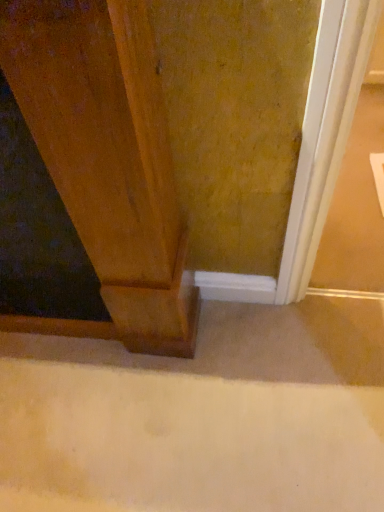
Describe the element at coordinates (206, 413) in the screenshot. I see `beige carpet at lower center` at that location.

The height and width of the screenshot is (512, 384). I want to click on beige carpet at lower center, so click(x=206, y=413).

The height and width of the screenshot is (512, 384). Describe the element at coordinates (108, 155) in the screenshot. I see `wooden door at left` at that location.

Locate an element on the screen. This screenshot has height=512, width=384. wooden door at left is located at coordinates (108, 155).

Locate an element on the screen. The width and height of the screenshot is (384, 512). beige carpet at lower center is located at coordinates (206, 413).

Does wooden door at left appear on the left side of beige carpet at lower center?

Yes.

Which object is further away from the camera taking this photo, wooden door at left or beige carpet at lower center?

beige carpet at lower center is more distant.

Does point (13, 89) come closer to viewer compared to point (123, 384)?

Yes, it is.

From the image's perspective, which is below, wooden door at left or beige carpet at lower center?

beige carpet at lower center, from the image's perspective.

From a real-world perspective, is wooden door at left under beige carpet at lower center?

Actually, wooden door at left is physically above beige carpet at lower center in the real world.

Which of these two, wooden door at left or beige carpet at lower center, is thinner?

With smaller width is wooden door at left.

Considering the sizes of wooden door at left and beige carpet at lower center in the image, is wooden door at left taller or shorter than beige carpet at lower center?

Considering their sizes, wooden door at left has more height than beige carpet at lower center.

Based on their sizes in the image, would you say wooden door at left is bigger or smaller than beige carpet at lower center?

In the image, wooden door at left appears to be larger than beige carpet at lower center.

Is wooden door at left positioned beyond the bounds of beige carpet at lower center?

wooden door at left lies outside beige carpet at lower center's area.

Is wooden door at left not near beige carpet at lower center?

No, wooden door at left is not far away from beige carpet at lower center.

Could you tell me if wooden door at left is turned towards beige carpet at lower center?

No, wooden door at left is not facing towards beige carpet at lower center.

How many degrees apart are the facing directions of wooden door at left and beige carpet at lower center?

89.9 degrees separate the facing orientations of wooden door at left and beige carpet at lower center.

Image resolution: width=384 pixels, height=512 pixels. Identify the location of door above the beige carpet at lower center (from the image's perspective). (108, 155).

Which is more to the left, beige carpet at lower center or wooden door at left?

wooden door at left.

Which is in front, beige carpet at lower center or wooden door at left?

wooden door at left is more forward.

Which is in front, point (188, 445) or point (63, 122)?

The point (63, 122) is in front.

From the image's perspective, is beige carpet at lower center located above wooden door at left?

No.

From a real-world perspective, is beige carpet at lower center positioned above or below wooden door at left?

In terms of real-world spatial position, beige carpet at lower center is below wooden door at left.

Can you confirm if beige carpet at lower center is thinner than wooden door at left?

No.

Is beige carpet at lower center taller than wooden door at left?

No, beige carpet at lower center is not taller than wooden door at left.

Looking at this image, in terms of size, does beige carpet at lower center appear bigger or smaller than wooden door at left?

In the image, beige carpet at lower center appears to be smaller than wooden door at left.

Is beige carpet at lower center inside or outside of wooden door at left?

The correct answer is: outside.

Based on the photo, are beige carpet at lower center and wooden door at left beside each other?

beige carpet at lower center and wooden door at left are clearly separated.

Is wooden door at left at the back of beige carpet at lower center?

No, beige carpet at lower center is not facing the opposite direction of wooden door at left.

How many degrees apart are the facing directions of beige carpet at lower center and wooden door at left?

There is a 89.9-degree angle between the facing directions of beige carpet at lower center and wooden door at left.

Locate an element on the screen. concrete that appears on the right of wooden door at left is located at coordinates (206, 413).

Locate an element on the screen. This screenshot has width=384, height=512. concrete behind the wooden door at left is located at coordinates (206, 413).

Find the location of a particular element. The width and height of the screenshot is (384, 512). concrete below the wooden door at left (from a real-world perspective) is located at coordinates (206, 413).